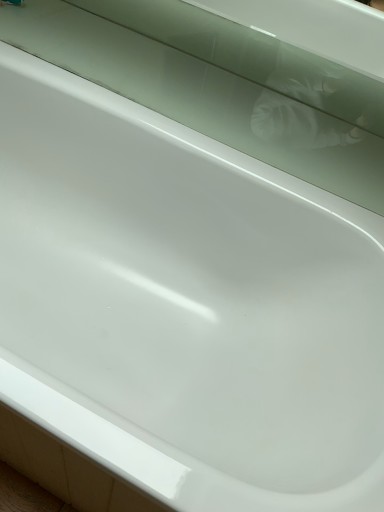
What is the approximate height of transparent glass door at upper center?

transparent glass door at upper center is 0.87 inches tall.

What do you see at coordinates (220, 84) in the screenshot? This screenshot has width=384, height=512. I see `transparent glass door at upper center` at bounding box center [220, 84].

I want to click on transparent glass door at upper center, so click(220, 84).

This screenshot has height=512, width=384. I want to click on transparent glass door at upper center, so click(220, 84).